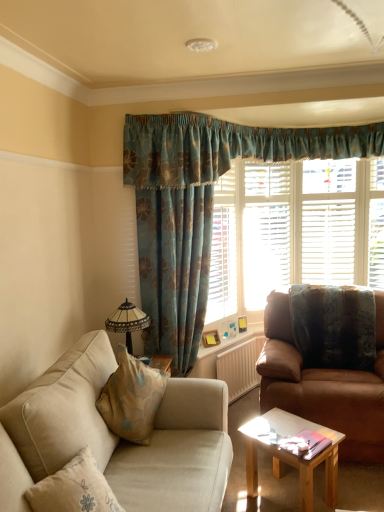
Question: From a real-world perspective, is brown leather couch at right, the second studio couch from the left, located higher than textured brown pillow at right?

Choices:
 (A) yes
 (B) no

Answer: (B)

Question: From the image's perspective, is brown leather couch at right, arranged as the 1th studio couch when viewed from the right, on textured brown pillow at right?

Choices:
 (A) yes
 (B) no

Answer: (B)

Question: Considering the relative sizes of brown leather couch at right, the second studio couch from the left, and textured brown pillow at right in the image provided, is brown leather couch at right, the second studio couch from the left, wider than textured brown pillow at right?

Choices:
 (A) no
 (B) yes

Answer: (B)

Question: Considering the relative positions of brown leather couch at right, arranged as the 1th studio couch when viewed from the right, and textured brown pillow at right in the image provided, is brown leather couch at right, arranged as the 1th studio couch when viewed from the right, to the right of textured brown pillow at right from the viewer's perspective?

Choices:
 (A) no
 (B) yes

Answer: (A)

Question: Is brown leather couch at right, the 2th studio couch positioned from the front, in front of textured brown pillow at right?

Choices:
 (A) no
 (B) yes

Answer: (B)

Question: Considering the positions of light brown wooden coffee table at center and brown leather couch at right, the second studio couch from the left, in the image, is light brown wooden coffee table at center taller or shorter than brown leather couch at right, the second studio couch from the left,?

Choices:
 (A) tall
 (B) short

Answer: (B)

Question: Is light brown wooden coffee table at center inside or outside of brown leather couch at right, arranged as the 1th studio couch when viewed from the back?

Choices:
 (A) outside
 (B) inside

Answer: (A)

Question: Looking at their shapes, would you say light brown wooden coffee table at center is wider or thinner than brown leather couch at right, the 2th studio couch positioned from the front?

Choices:
 (A) thin
 (B) wide

Answer: (A)

Question: From a real-world perspective, relative to brown leather couch at right, arranged as the 1th studio couch when viewed from the back, is light brown wooden coffee table at center vertically above or below?

Choices:
 (A) below
 (B) above

Answer: (A)

Question: Is point (114, 330) closer or farther from the camera than point (309, 356)?

Choices:
 (A) farther
 (B) closer

Answer: (B)

Question: Is stained glass lampshade at left wider or thinner than textured brown pillow at right?

Choices:
 (A) thin
 (B) wide

Answer: (A)

Question: Is stained glass lampshade at left inside the boundaries of textured brown pillow at right, or outside?

Choices:
 (A) inside
 (B) outside

Answer: (B)

Question: From their relative heights in the image, would you say stained glass lampshade at left is taller or shorter than textured brown pillow at right?

Choices:
 (A) tall
 (B) short

Answer: (B)

Question: Which is correct: white textured radiator at center is inside beige fabric couch at lower left, which is the first studio couch in front-to-back order, or outside of it?

Choices:
 (A) outside
 (B) inside

Answer: (A)

Question: In terms of height, does white textured radiator at center look taller or shorter compared to beige fabric couch at lower left, the 2th studio couch positioned from the right?

Choices:
 (A) tall
 (B) short

Answer: (B)